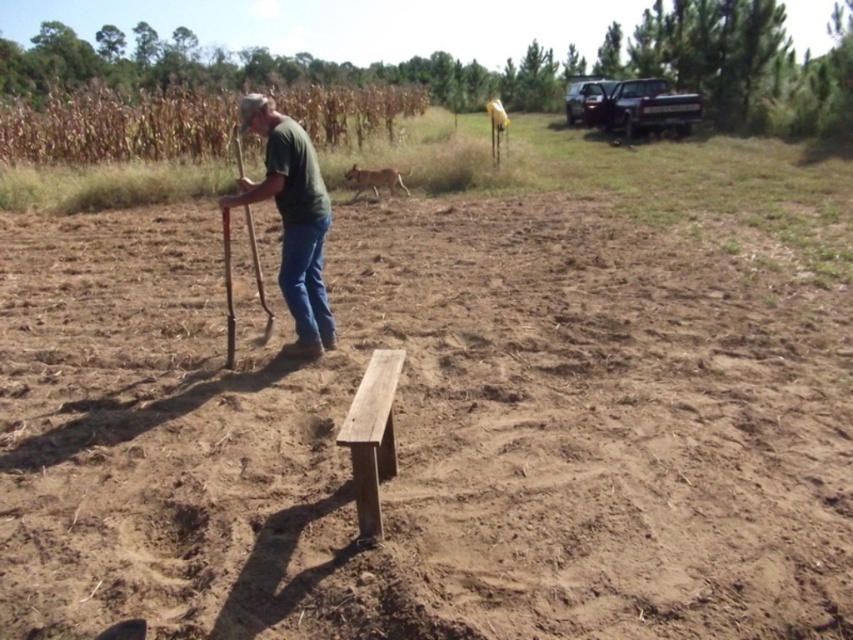
Consider the image. Based on the scene described, which object is taller between the brown stalks of corn at upper left and the smooth brown bench at center?

The brown stalks of corn at upper left are taller than the smooth brown bench at center.